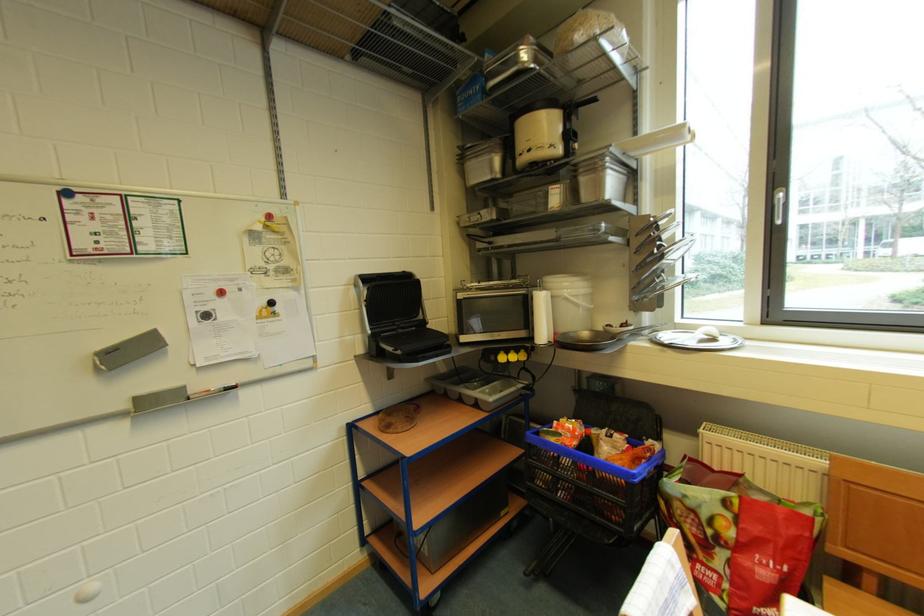
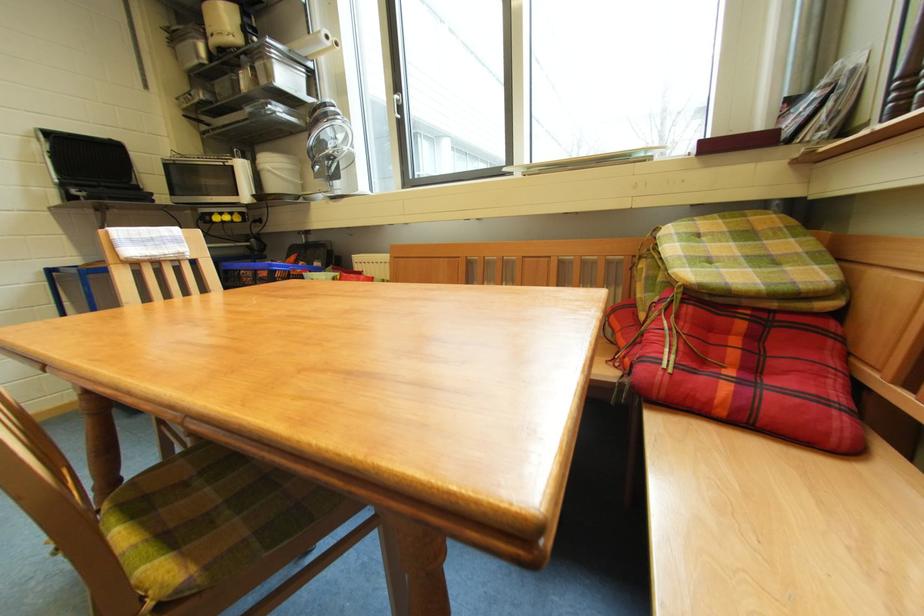
Find the pixel in the second image that matches (x=643, y=238) in the first image.

(319, 121)